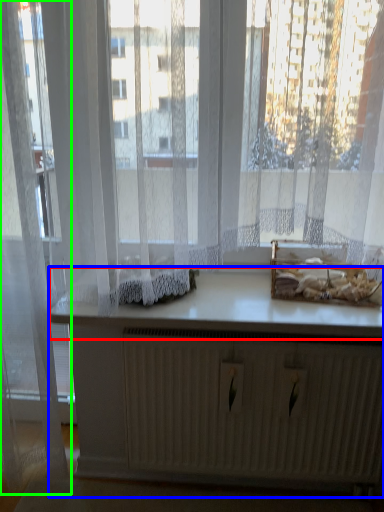
Question: Which is farther away from counter top (highlighted by a red box)? vanity (highlighted by a blue box) or curtain (highlighted by a green box)?

Choices:
 (A) vanity
 (B) curtain

Answer: (B)